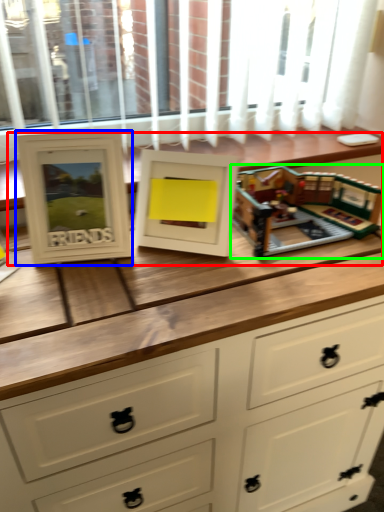
Question: Which is nearer to the buffet (highlighted by a red box)? picture frame (highlighted by a blue box) or toy (highlighted by a green box).

Choices:
 (A) picture frame
 (B) toy

Answer: (B)